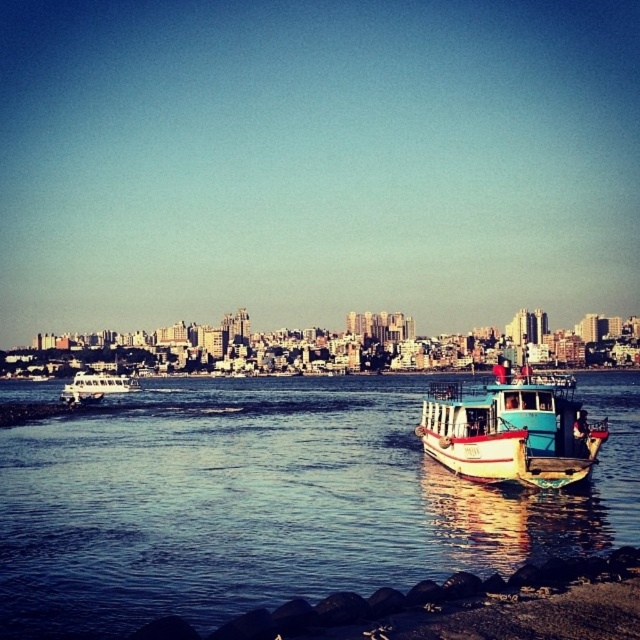
Question: Which of the following is the closest to the observer?

Choices:
 (A) teal wooden boat at right
 (B) white matte boat at lower right
 (C) white matte boat at left

Answer: (B)

Question: Estimate the real-world distances between objects in this image. Which object is closer to the white matte boat at left?

Choices:
 (A) white matte boat at lower right
 (B) teal wooden boat at right

Answer: (A)

Question: Based on their relative distances, which object is nearer to the white matte boat at left?

Choices:
 (A) teal wooden boat at right
 (B) white matte boat at lower right

Answer: (B)

Question: Can you confirm if white matte boat at lower right is positioned to the left of white matte boat at left?

Choices:
 (A) yes
 (B) no

Answer: (B)

Question: Does teal wooden boat at right appear under white matte boat at left?

Choices:
 (A) no
 (B) yes

Answer: (A)

Question: Can you confirm if white matte boat at lower right is positioned to the right of white matte boat at left?

Choices:
 (A) yes
 (B) no

Answer: (A)